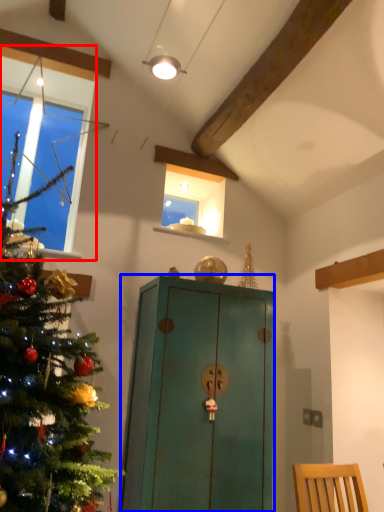
Question: Which object appears closest to the camera in this image, window (highlighted by a red box) or cabinetry (highlighted by a blue box)?

Choices:
 (A) window
 (B) cabinetry

Answer: (B)